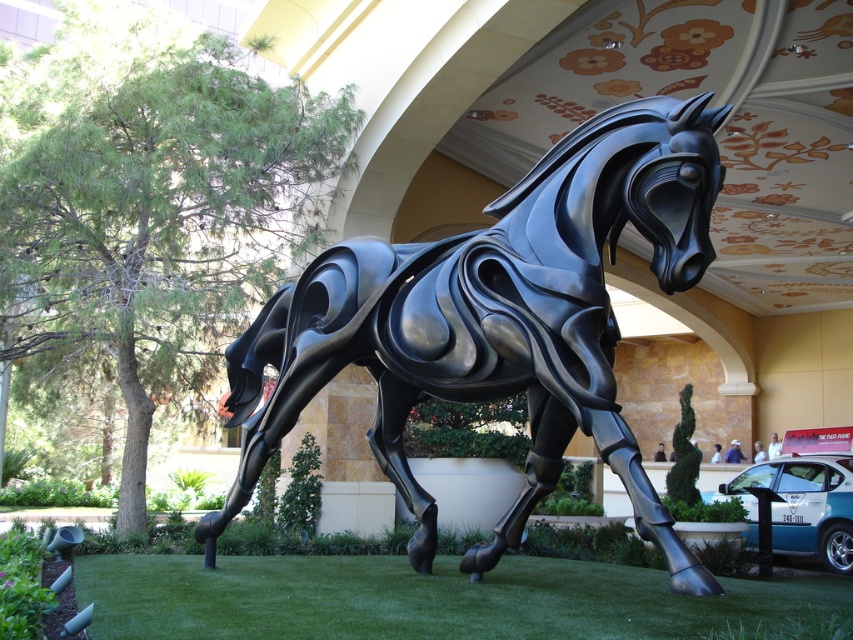
You are a maintenance worker who needs to clean the glossy black horse at center and the green grass at lower center. You have a 10 foot extension pole. Can you reach both areas from your current position without moving closer?

The glossy black horse at center is 8.74 feet away from green grass at lower center. Since the extension pole is 10 feet long, you can reach both areas as the distance between them is within the pole length.

You are a landscape architect designing a garden around the glossy black horse at center and the green grass at lower center. Based on their sizes, which object would require more space for maintenance and why?

The glossy black horse at center requires more space for maintenance because it is larger in size than the green grass at lower center.

You are a landscape architect designing a garden around the glossy black horse at center and green grass at lower center. Considering their sizes, which object requires more space horizontally?

The glossy black horse at center requires more horizontal space because its width surpasses that of the green grass at lower center.